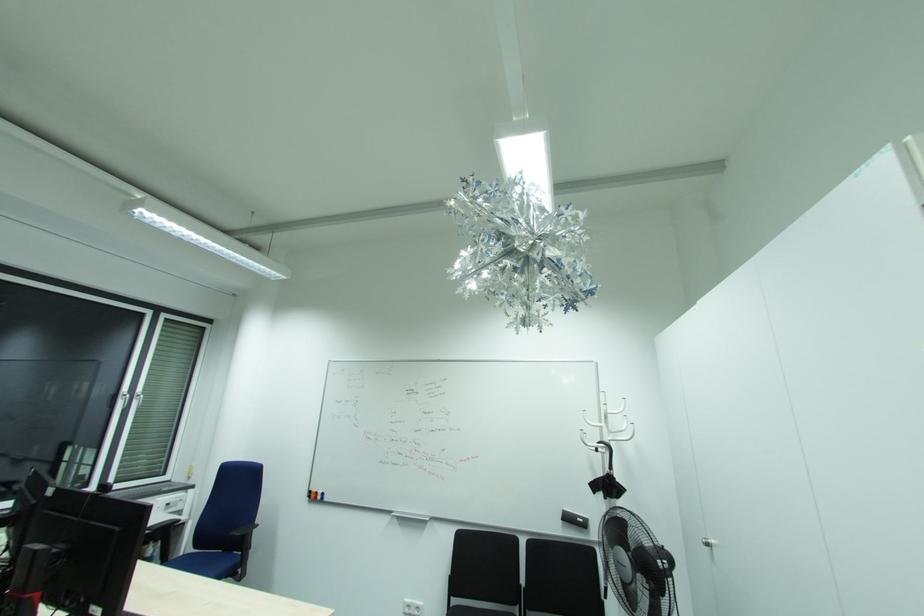
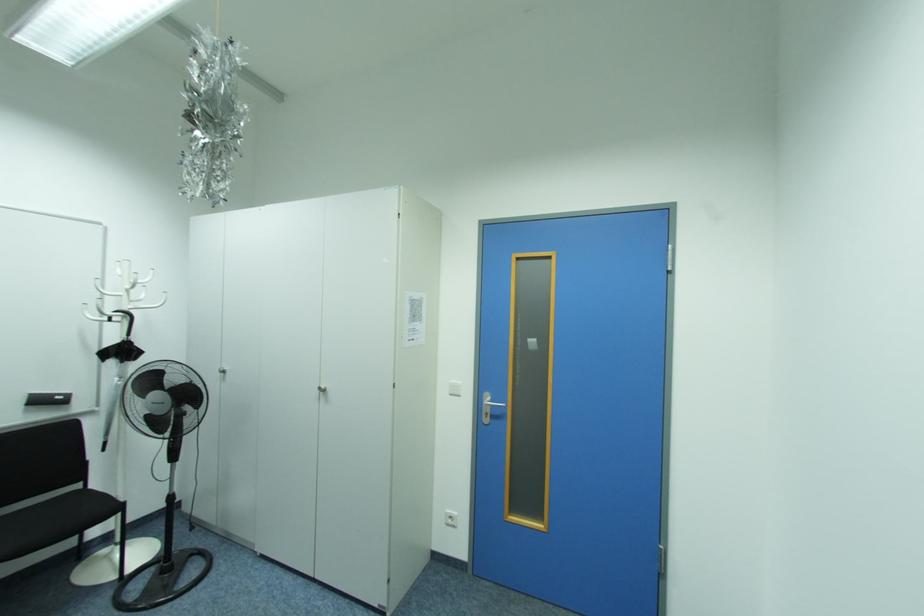
Question: How did the camera likely rotate?

Choices:
 (A) Left
 (B) Right
 (C) Up
 (D) Down

Answer: (B)